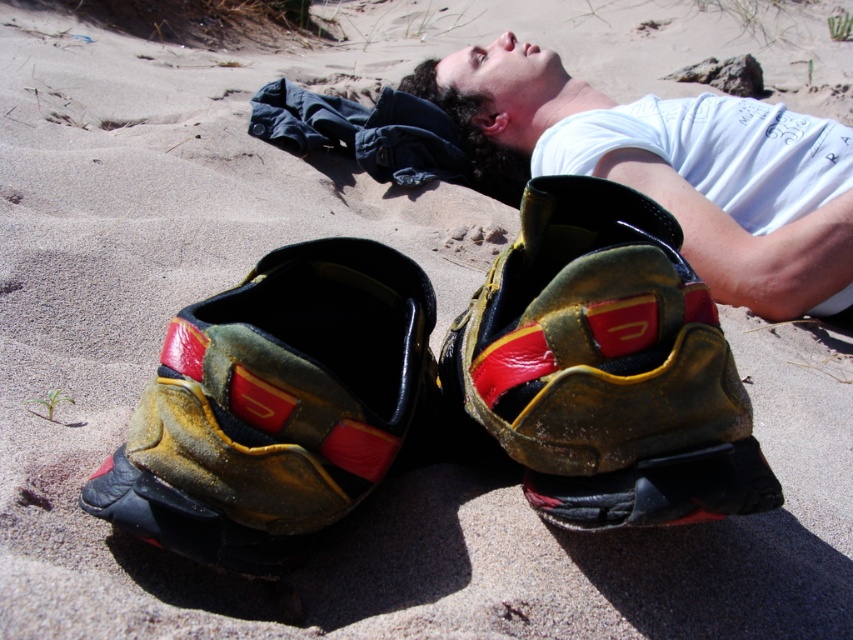
Can you confirm if yellow-green leather shoe at center is bigger than matte white t-shirt at upper right?

Actually, yellow-green leather shoe at center might be smaller than matte white t-shirt at upper right.

The image size is (853, 640). Describe the element at coordinates (606, 368) in the screenshot. I see `yellow-green leather shoe at center` at that location.

Who is more distant from viewer, (688, 509) or (521, 156)?

Point (521, 156)

Find the location of `yellow-green leather shoe at center`. yellow-green leather shoe at center is located at coordinates (606, 368).

Which is in front, point (596, 444) or point (216, 554)?

Point (216, 554) is in front.

Which is more to the left, yellow-green leather shoe at center or yellow leather shoe at lower left?

yellow leather shoe at lower left

Which is in front, point (531, 243) or point (306, 531)?

Point (306, 531)

What are the coordinates of `yellow-green leather shoe at center` in the screenshot? It's located at (606, 368).

Does point (308, 506) come behind point (796, 188)?

No.

You are a GUI agent. You are given a task and a screenshot of the screen. Output one action in this format:
    pyautogui.click(x=<x>, y=<y>)
    Task: Click on the yellow leather shoe at lower left
    This screenshot has width=853, height=640.
    Given the screenshot: What is the action you would take?
    pyautogui.click(x=274, y=406)

Is point (315, 422) behind point (526, 72)?

That is False.

This screenshot has height=640, width=853. In order to click on yellow leather shoe at lower left in this screenshot , I will do `click(274, 406)`.